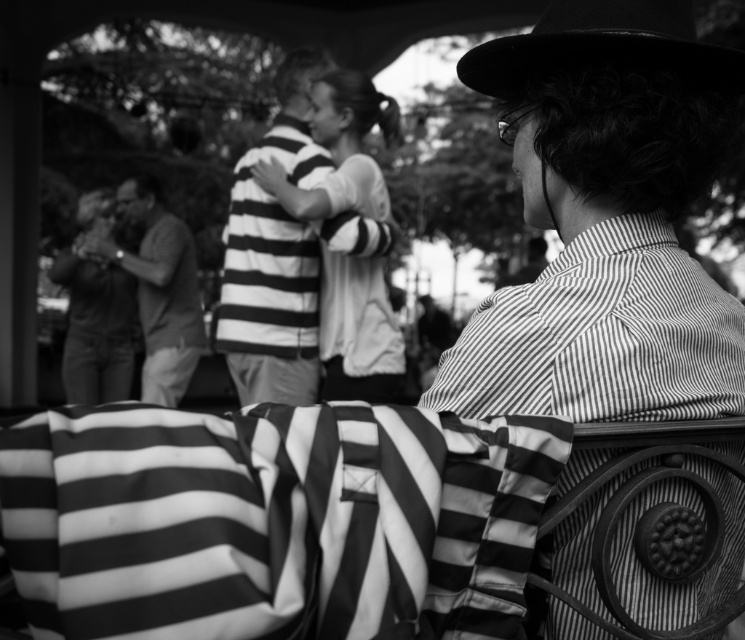
You are a photographer reviewing this black and white photo. You notice the black felt hat at upper right. Could you estimate its location in terms of coordinates relative to the image frame?

The black felt hat at upper right is located at coordinates approximately 0.070 on the x axis and 0.809 on the y axis.

You are standing at the point labeled as point (602,44) in the image. What object is directly above you?

The point (602,44) is on the black felt hat at upper right, so the object directly above you is the black felt hat at upper right.